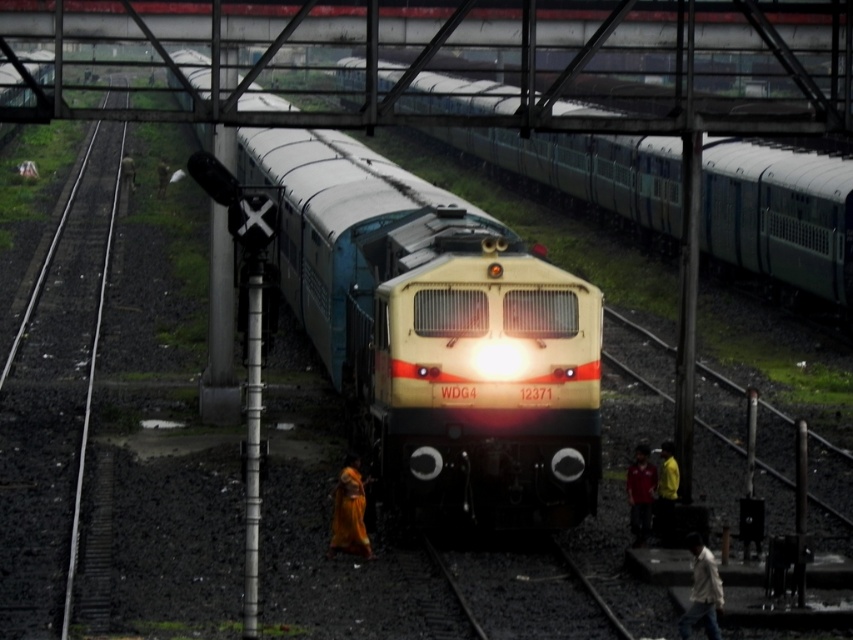
Can you confirm if matte yellow locomotive at center is wider than metallic blue train at center?

Yes.

Between matte yellow locomotive at center and metallic blue train at center, which one has less height?

Standing shorter between the two is matte yellow locomotive at center.

The height and width of the screenshot is (640, 853). In order to click on matte yellow locomotive at center in this screenshot , I will do `click(438, 333)`.